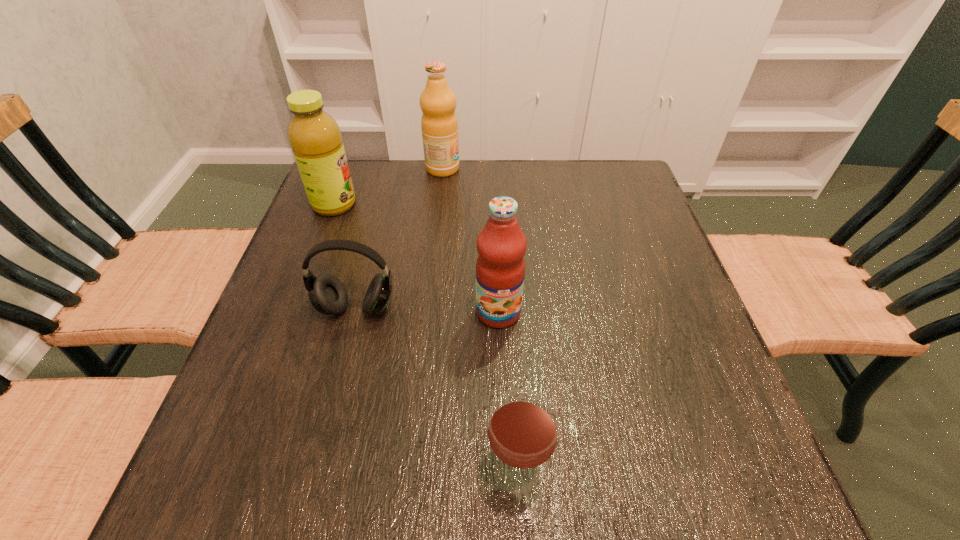
Where is `the farthest object`? the farthest object is located at coordinates (439, 124).

Where is `the third object from left to right`? Image resolution: width=960 pixels, height=540 pixels. the third object from left to right is located at coordinates (439, 124).

You are a GUI agent. You are given a task and a screenshot of the screen. Output one action in this format:
    pyautogui.click(x=<x>, y=<y>)
    Task: Click on the leftmost fruit juice
    The image size is (960, 540).
    Given the screenshot: What is the action you would take?
    pyautogui.click(x=315, y=138)

Locate an element on the screen. the second farthest fruit juice is located at coordinates (315, 138).

Find the location of a particular element. the rightmost fruit juice is located at coordinates (501, 245).

Image resolution: width=960 pixels, height=540 pixels. I want to click on headset, so click(x=327, y=294).

Identify the location of wineglass. (523, 425).

Locate an element on the screen. The width and height of the screenshot is (960, 540). free space located on the front label of the third object from right to left is located at coordinates point(480,168).

Locate an element on the screen. The image size is (960, 540). vacant position located on the front label of the leftmost fruit juice is located at coordinates (497, 205).

Locate an element on the screen. free spot located 0.120m on the front label of the nearest fruit juice is located at coordinates (501, 383).